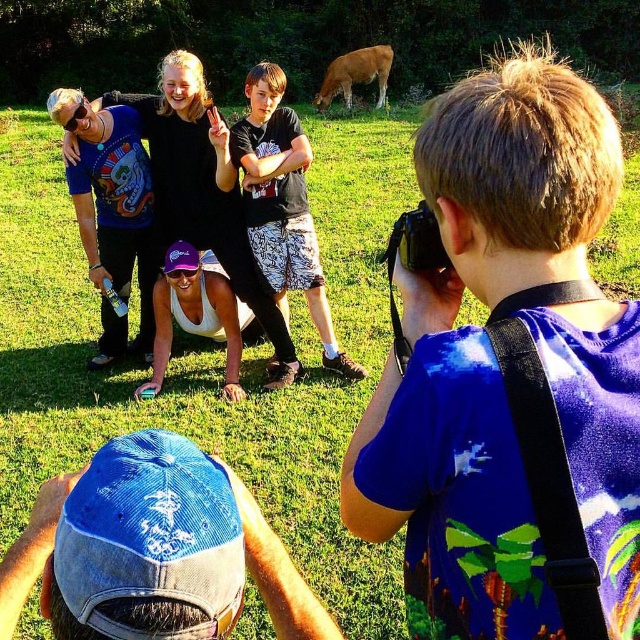
Who is shorter, black cotton shirt at center or brown furry cow at upper center?

Standing shorter between the two is black cotton shirt at center.

Which is above, black cotton shirt at center or brown furry cow at upper center?

brown furry cow at upper center is higher up.

Which is behind, point (353, 378) or point (352, 76)?

Point (352, 76)

Locate an element on the screen. The height and width of the screenshot is (640, 640). black cotton shirt at center is located at coordinates (282, 205).